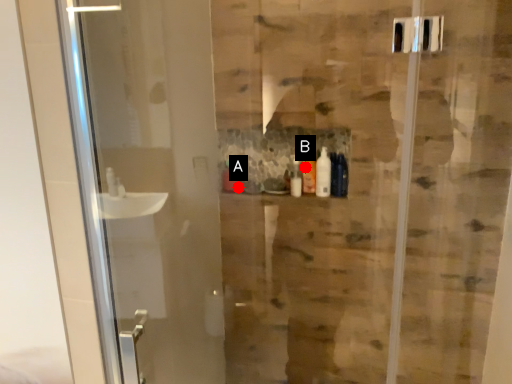
Question: Two points are circled on the image, labeled by A and B beside each circle. Which point is closer to the camera?

Choices:
 (A) A is closer
 (B) B is closer

Answer: (B)